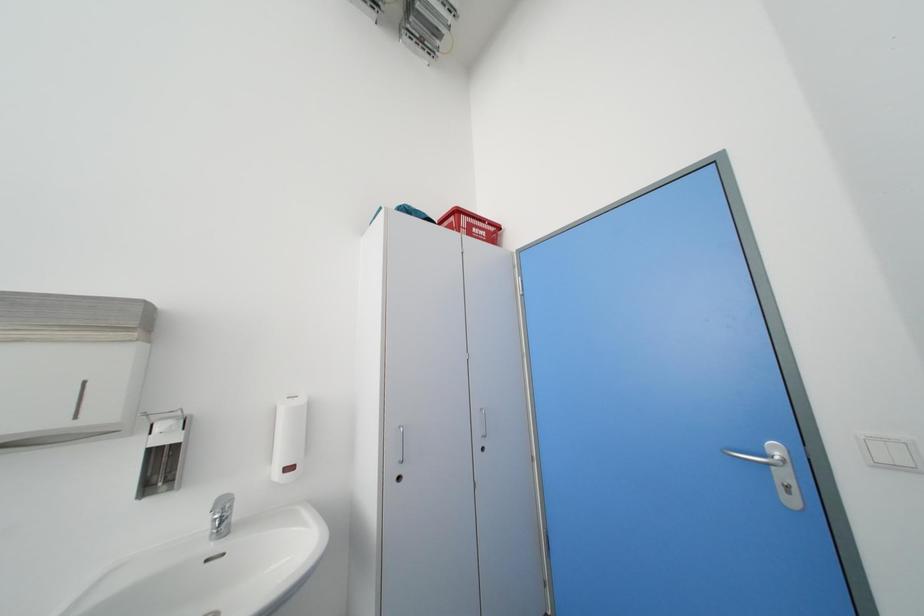
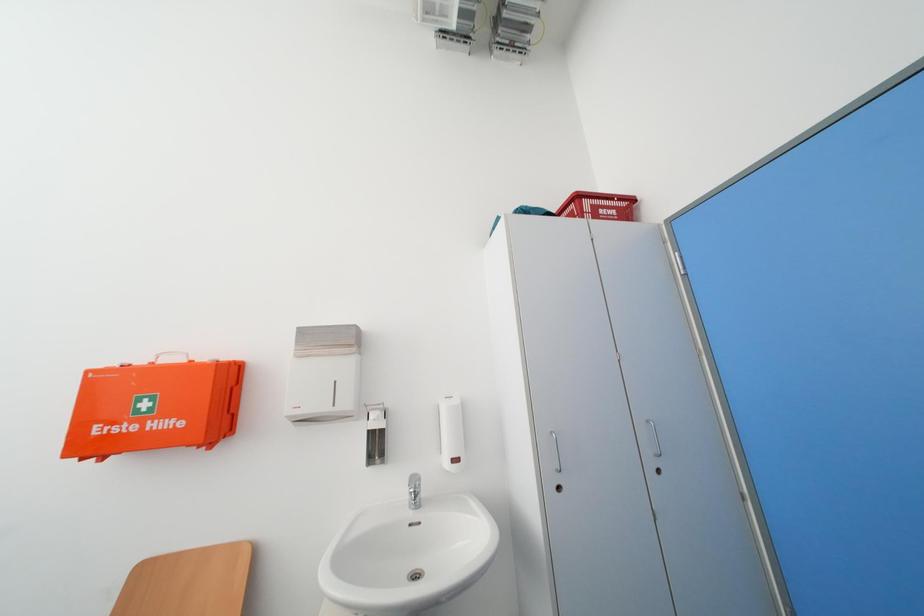
Question: How did the camera likely rotate?

Choices:
 (A) Left
 (B) Right
 (C) Up
 (D) Down

Answer: (A)